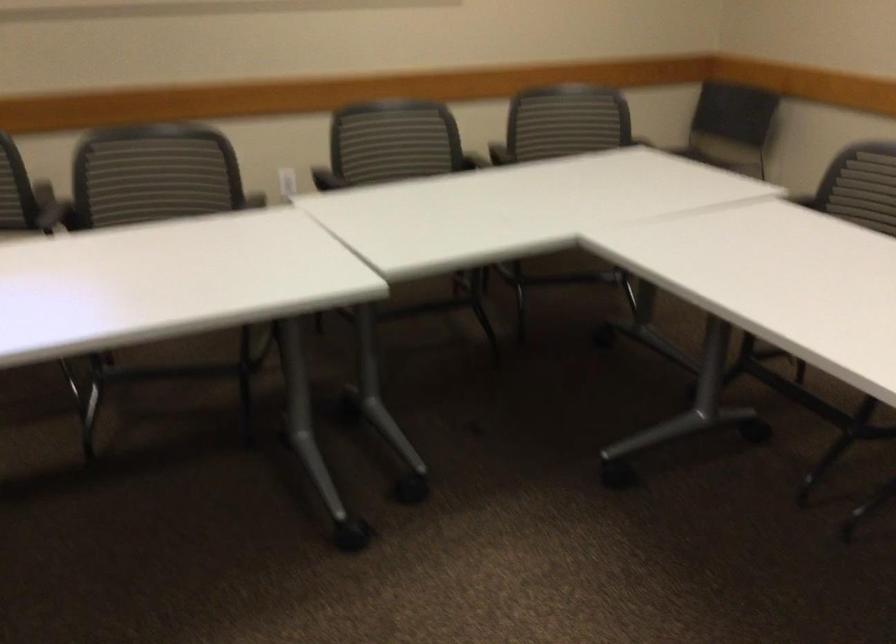
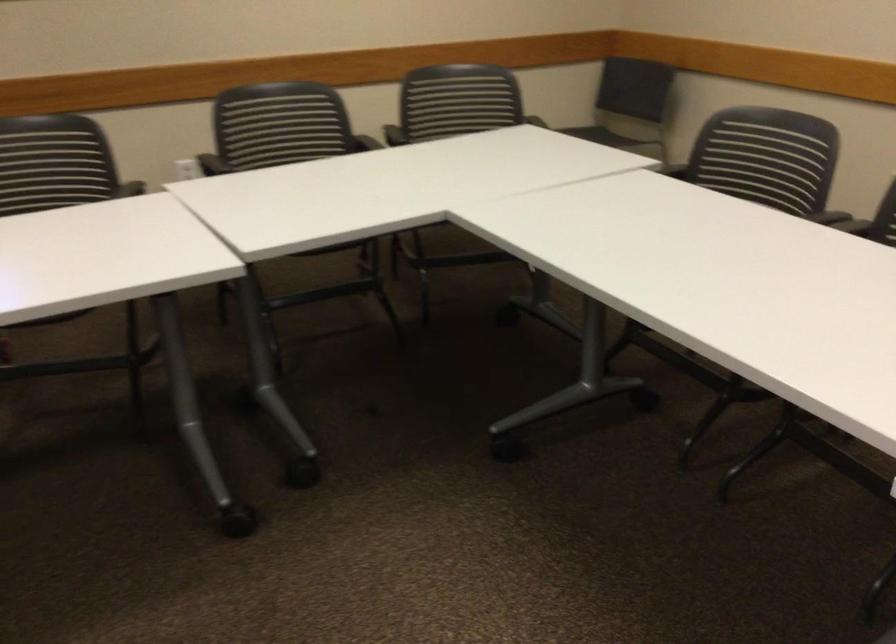
Question: I am providing you with two images of the same scene from different viewpoints. Please identify which objects are invisible in image2.

Choices:
 (A) white floor towel
 (B) black chair sitting surface
 (C) black chair armrest
 (D) chair sitting surface

Answer: (D)